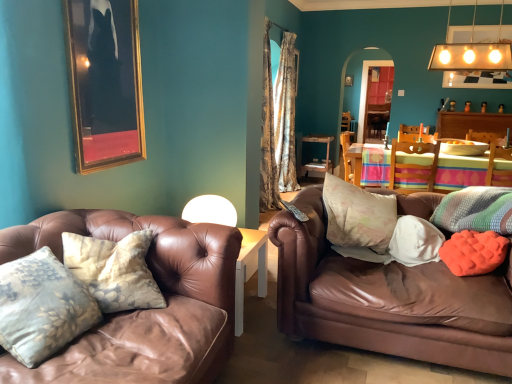
Question: Is orange fabric pillow at right, the 1th pillow positioned from the back, spatially inside gold-framed picture at upper left, or outside of it?

Choices:
 (A) inside
 (B) outside

Answer: (B)

Question: In terms of height, does orange fabric pillow at right, which is the 6th pillow from left to right, look taller or shorter compared to gold-framed picture at upper left?

Choices:
 (A) tall
 (B) short

Answer: (B)

Question: Estimate the real-world distances between objects in this image. Which object is closer to the white fabric pillow at right, which appears as the third pillow when viewed from the left?

Choices:
 (A) wooden table at center, the first table viewed from the back
 (B) wooden chair at center
 (C) orange fabric pillow at right, which is the 6th pillow from left to right
 (D) orange textured pillow at right, placed as the third pillow when sorted from front to back
 (E) white matte lampshade at center, which ranks as the 1th lamp in bottom-to-top order

Answer: (D)

Question: Which is nearer to the fluffy cotton pillow at center, arranged as the 2th pillow when viewed from the left?

Choices:
 (A) wooden table at center, marked as the second table in a front-to-back arrangement
 (B) white fabric pillow at right, positioned as the third pillow in back-to-front order
 (C) wooden chair at center
 (D) camouflage fabric curtain at center
 (E) brown leather couch at right

Answer: (B)